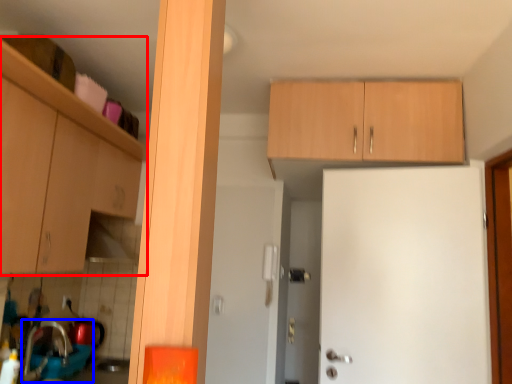
Question: Which object appears farthest to the camera in this image, cabinetry (highlighted by a red box) or sink (highlighted by a blue box)?

Choices:
 (A) cabinetry
 (B) sink

Answer: (B)